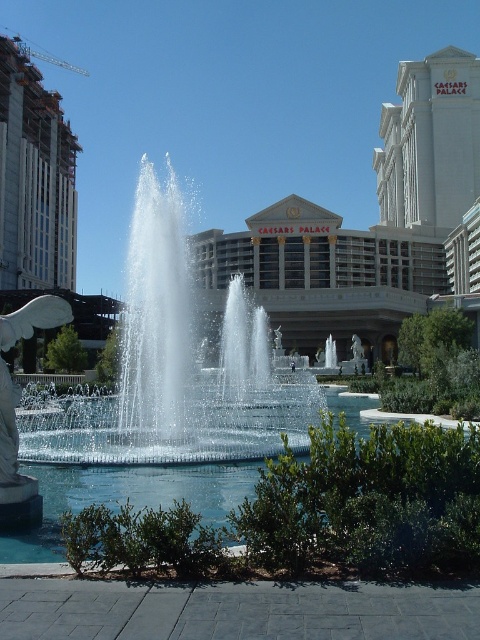
Question: Is clear glass water at center positioned behind white marble statue at left?

Choices:
 (A) yes
 (B) no

Answer: (A)

Question: Is clear glass water at center to the left of white marble statue at left from the viewer's perspective?

Choices:
 (A) yes
 (B) no

Answer: (A)

Question: Is clear glass water at center thinner than white marble statue at left?

Choices:
 (A) yes
 (B) no

Answer: (B)

Question: Which object appears closest to the camera in this image?

Choices:
 (A) white marble statue at left
 (B) clear glass water at center

Answer: (A)